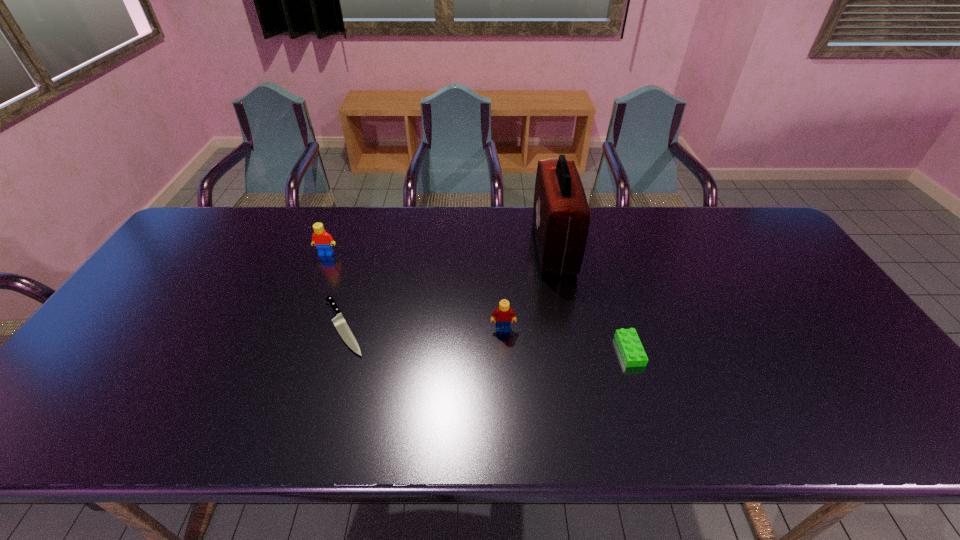
I want to click on vacant region that satisfies the following two spatial constraints: 1. on the front-facing side of the second Lego from left to right; 2. on the left side of the nearest Lego, so click(504, 350).

Image resolution: width=960 pixels, height=540 pixels. What are the coordinates of `vacant area that satisfies the following two spatial constraints: 1. on the side of the first aid kit with the cross symbol; 2. on the left side of the rightmost object` in the screenshot? It's located at click(574, 350).